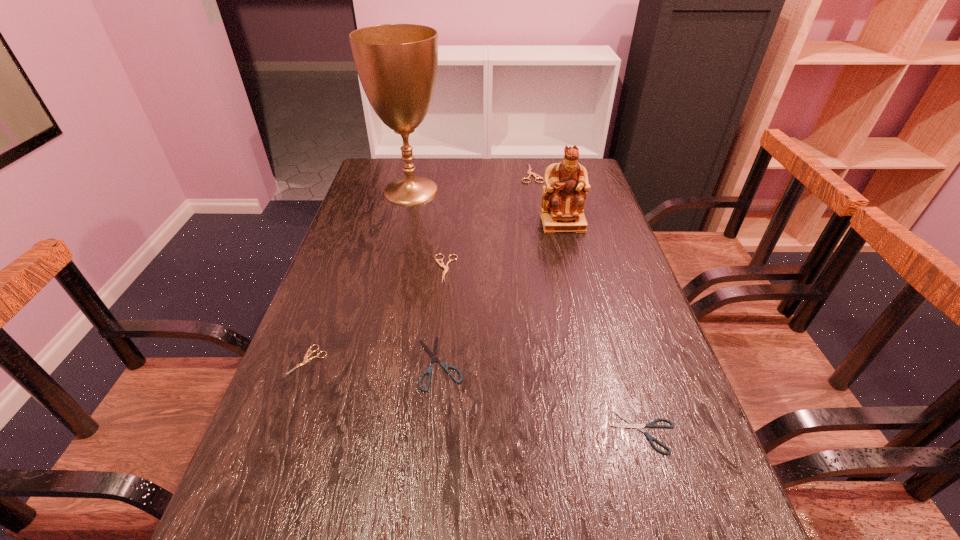
Identify the location of the nearest beige shears. (307, 355).

Find the location of `the rightmost shears`. the rightmost shears is located at coordinates (633, 425).

I want to click on the right black shears, so [633, 425].

Find the location of a particular element. The width and height of the screenshot is (960, 540). vacant space located 0.120m on the right of the trophy cup is located at coordinates (482, 191).

Locate an element on the screen. The width and height of the screenshot is (960, 540). vacant position located 0.250m on the front-facing side of the sixth shortest object is located at coordinates (580, 291).

You are a GUI agent. You are given a task and a screenshot of the screen. Output one action in this format:
    pyautogui.click(x=<x>, y=<y>)
    Task: Click on the vacant space situated 0.160m on the left of the tallest shears
    This screenshot has width=960, height=540.
    Given the screenshot: What is the action you would take?
    pyautogui.click(x=476, y=173)

Locate an element on the screen. The width and height of the screenshot is (960, 540). vacant space positioned 0.140m on the back of the second farthest beige shears is located at coordinates (449, 226).

You are a GUI agent. You are given a task and a screenshot of the screen. Output one action in this format:
    pyautogui.click(x=<x>, y=<y>)
    Task: Click on the blank area located on the right of the bigger black shears
    
    Given the screenshot: What is the action you would take?
    pyautogui.click(x=539, y=362)

Find the location of a particular element. This screenshot has height=540, width=960. vacant space located 0.220m on the back of the leftmost beige shears is located at coordinates (338, 280).

You are a GUI agent. You are given a task and a screenshot of the screen. Output one action in this format:
    pyautogui.click(x=<x>, y=<y>)
    Task: Click on the vacant point located 0.300m on the left of the right black shears
    The image size is (960, 540).
    Given the screenshot: What is the action you would take?
    pyautogui.click(x=451, y=432)